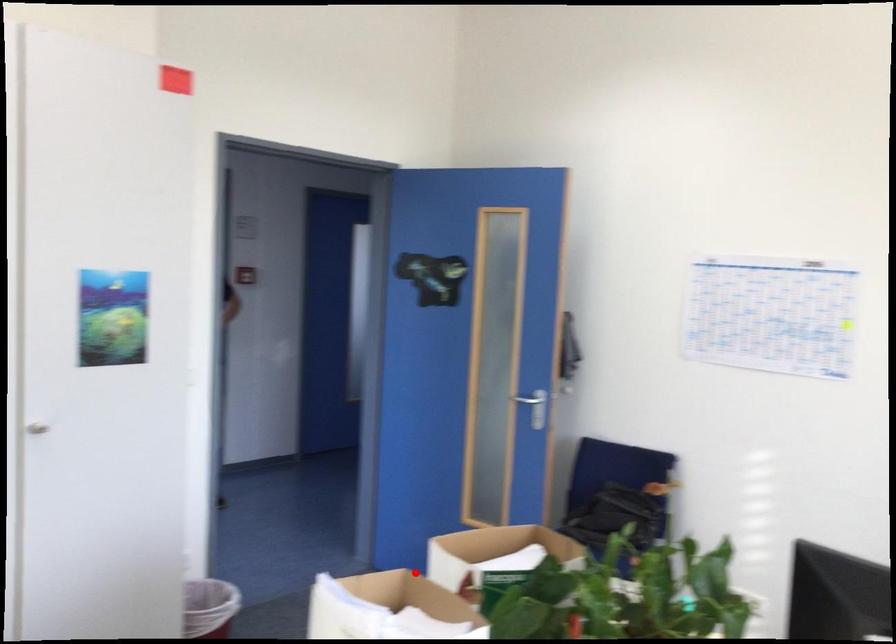
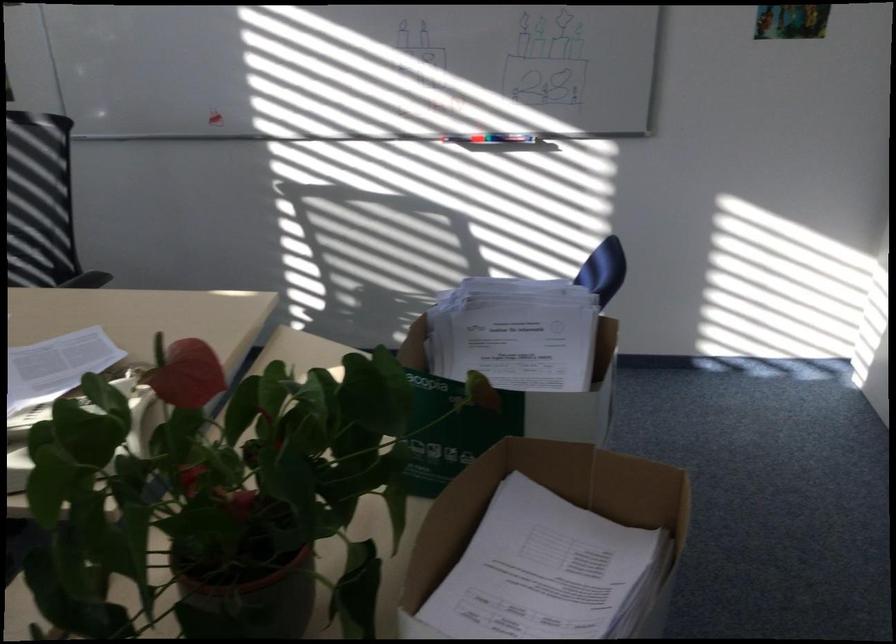
The point at the highlighted location is marked in the first image. Where is the corresponding point in the second image?

(550, 515)